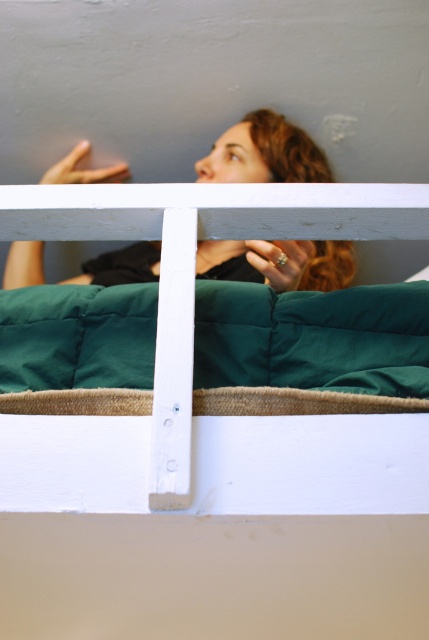
What do you see at coordinates (215, 531) in the screenshot? I see `green quilted fabric at upper center` at bounding box center [215, 531].

Is green quilted fabric at upper center to the right of matte black hair at upper center from the viewer's perspective?

Indeed, green quilted fabric at upper center is positioned on the right side of matte black hair at upper center.

Locate an element on the screen. green quilted fabric at upper center is located at coordinates (215, 531).

Is green quilted fabric at upper center positioned in front of green down-filled pillow at center?

Yes, it is.

Between point (289, 550) and point (399, 362), which one is positioned behind?

The point (399, 362) is behind.

Who is more forward, [145,188] or [314,356]?

Point [145,188]

Where is `green quilted fabric at upper center`? This screenshot has height=640, width=429. green quilted fabric at upper center is located at coordinates click(215, 531).

Who is taller, green down-filled pillow at center or matte black hair at upper center?

With more height is matte black hair at upper center.

Who is positioned more to the right, green down-filled pillow at center or matte black hair at upper center?

green down-filled pillow at center is more to the right.

Where is `green down-filled pillow at center`? green down-filled pillow at center is located at coordinates (314, 339).

The image size is (429, 640). I want to click on green down-filled pillow at center, so click(314, 339).